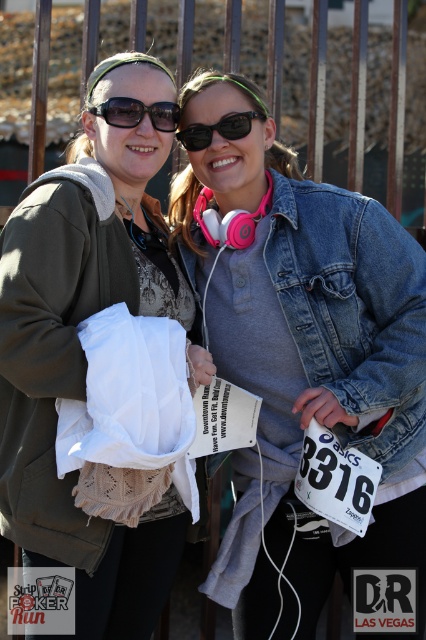
Is matte black sunglasses at upper center shorter than black matte sunglasses at center?

Correct, matte black sunglasses at upper center is not as tall as black matte sunglasses at center.

Does point (135, 118) lie behind point (264, 116)?

No, it is in front of (264, 116).

Find the location of `matte black sunglasses at upper center`. matte black sunglasses at upper center is located at coordinates (138, 113).

Which is below, matte green jacket at left or black matte sunglasses at center?

Positioned lower is matte green jacket at left.

Which of these two, matte green jacket at left or black matte sunglasses at center, stands shorter?

black matte sunglasses at center is shorter.

This screenshot has width=426, height=640. What do you see at coordinates (83, 349) in the screenshot? I see `matte green jacket at left` at bounding box center [83, 349].

Image resolution: width=426 pixels, height=640 pixels. I want to click on matte green jacket at left, so click(83, 349).

Consider the image. Between denim jacket at center and black matte sunglasses at center, which one is positioned higher?

Positioned higher is black matte sunglasses at center.

Which is in front, point (356, 260) or point (201, 141)?

Positioned in front is point (356, 260).

At what (x,y) coordinates should I click in order to perform the action: click on denim jacket at center. Please return your answer as a coordinate pair (x, y). The image size is (426, 640). Looking at the image, I should click on (316, 348).